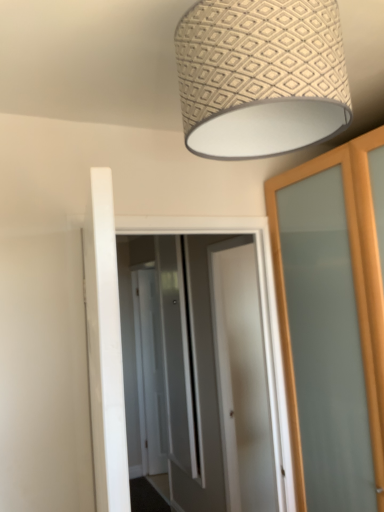
Question: Can you confirm if white glossy door at center, arranged as the 1th screen door when viewed from the front, is taller than patterned fabric lampshade at upper center?

Choices:
 (A) no
 (B) yes

Answer: (B)

Question: Can you confirm if white glossy door at center, the 3th screen door when ordered from back to front, is shorter than patterned fabric lampshade at upper center?

Choices:
 (A) yes
 (B) no

Answer: (B)

Question: Does white glossy door at center, arranged as the 1th screen door when viewed from the front, have a greater width compared to patterned fabric lampshade at upper center?

Choices:
 (A) no
 (B) yes

Answer: (A)

Question: Is white glossy door at center, arranged as the 1th screen door when viewed from the front, with patterned fabric lampshade at upper center?

Choices:
 (A) yes
 (B) no

Answer: (B)

Question: Does white glossy door at center, arranged as the 1th screen door when viewed from the front, have a smaller size compared to patterned fabric lampshade at upper center?

Choices:
 (A) no
 (B) yes

Answer: (A)

Question: Considering the positions of patterned fabric lampshade at upper center and clear glass screen door at center, the 2th screen door viewed from the back, in the image, is patterned fabric lampshade at upper center bigger or smaller than clear glass screen door at center, the 2th screen door viewed from the back,?

Choices:
 (A) small
 (B) big

Answer: (B)

Question: Is patterned fabric lampshade at upper center to the left or to the right of clear glass screen door at center, the 2th screen door viewed from the back, in the image?

Choices:
 (A) left
 (B) right

Answer: (B)

Question: Does point (198, 72) appear closer or farther from the camera than point (180, 340)?

Choices:
 (A) closer
 (B) farther

Answer: (A)

Question: From the image's perspective, relative to clear glass screen door at center, which is the 2th screen door from front to back, is patterned fabric lampshade at upper center above or below?

Choices:
 (A) below
 (B) above

Answer: (B)

Question: Relative to white glossy door at center, which is counted as the 3th screen door, starting from the front, is white glossy door at center, the 3th screen door when ordered from back to front, in front or behind?

Choices:
 (A) front
 (B) behind

Answer: (A)

Question: In terms of size, does white glossy door at center, the 3th screen door when ordered from back to front, appear bigger or smaller than white glossy door at center, acting as the first screen door starting from the back?

Choices:
 (A) big
 (B) small

Answer: (B)

Question: From the image's perspective, is white glossy door at center, the 3th screen door when ordered from back to front, above or below white glossy door at center, acting as the first screen door starting from the back?

Choices:
 (A) below
 (B) above

Answer: (B)

Question: Based on their positions, is white glossy door at center, the 3th screen door when ordered from back to front, located to the left or right of white glossy door at center, which is counted as the 3th screen door, starting from the front?

Choices:
 (A) right
 (B) left

Answer: (A)

Question: From the image's perspective, is patterned fabric lampshade at upper center above or below white glossy door at center, arranged as the 1th screen door when viewed from the front?

Choices:
 (A) above
 (B) below

Answer: (A)

Question: Is point (188, 92) closer or farther from the camera than point (218, 325)?

Choices:
 (A) farther
 (B) closer

Answer: (B)